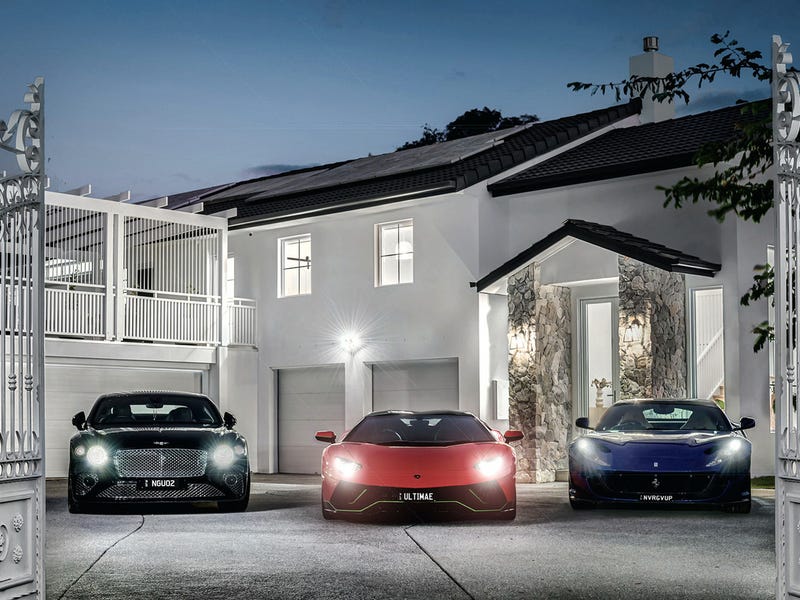
Locate an element on the screen. Image resolution: width=800 pixels, height=600 pixels. chimney is located at coordinates (646, 38).